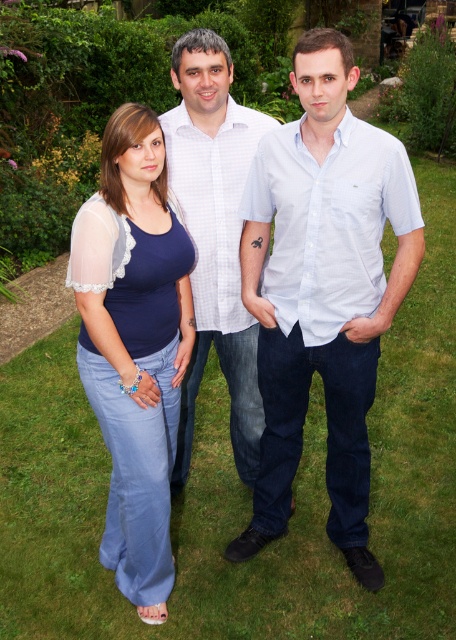
Does light blue cotton shirt at center have a lesser height compared to blue denim jeans at center?

In fact, light blue cotton shirt at center may be taller than blue denim jeans at center.

Is point (342, 305) positioned before point (88, 257)?

No.

Where is `light blue cotton shirt at center`? The width and height of the screenshot is (456, 640). light blue cotton shirt at center is located at coordinates (324, 291).

Does blue denim jeans at center appear under white checkered shirt at center?

Yes, blue denim jeans at center is below white checkered shirt at center.

This screenshot has width=456, height=640. Find the location of `blue denim jeans at center`. blue denim jeans at center is located at coordinates (134, 346).

The width and height of the screenshot is (456, 640). Identify the location of blue denim jeans at center. (134, 346).

Between light blue cotton shirt at center and white checkered shirt at center, which one appears on the left side from the viewer's perspective?

Positioned to the left is white checkered shirt at center.

Which is below, light blue cotton shirt at center or white checkered shirt at center?

light blue cotton shirt at center is lower down.

Is point (368, 580) positioned before point (196, 221)?

Yes, point (368, 580) is in front of point (196, 221).

This screenshot has width=456, height=640. I want to click on light blue cotton shirt at center, so click(x=324, y=291).